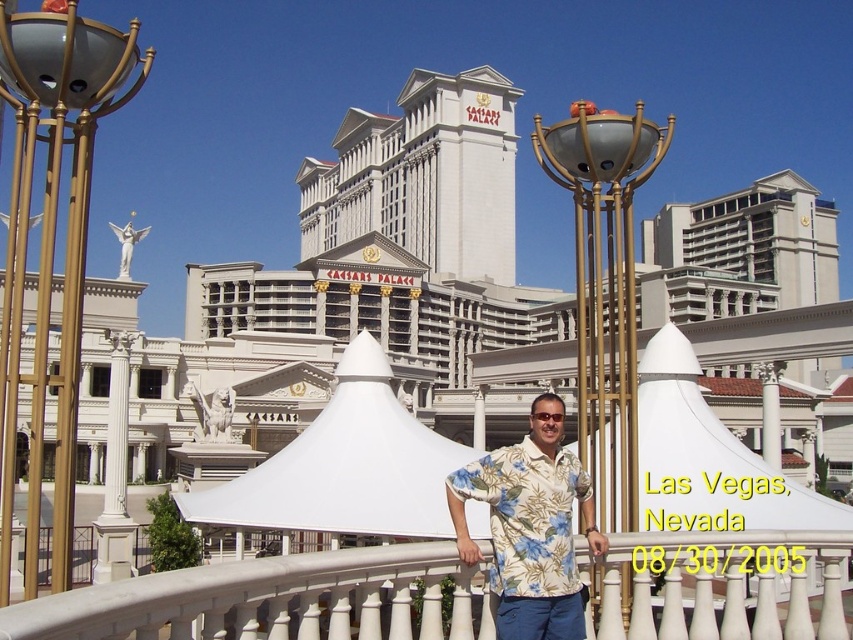
Does white glossy rail at center have a greater width compared to gold metallic lamp post at center?

Incorrect, white glossy rail at center's width does not surpass gold metallic lamp post at center's.

Does white glossy rail at center appear on the left side of gold metallic lamp post at center?

Yes, white glossy rail at center is to the left of gold metallic lamp post at center.

This screenshot has height=640, width=853. What are the coordinates of `white glossy rail at center` in the screenshot? It's located at (270, 600).

Identify the location of white glossy rail at center. (270, 600).

Can you confirm if gold metallic lamp post at upper left is wider than gold metallic lamp post at center?

Indeed, gold metallic lamp post at upper left has a greater width compared to gold metallic lamp post at center.

Consider the image. Does gold metallic lamp post at upper left have a lesser width compared to gold metallic lamp post at center?

No.

Which is in front, point (32, 406) or point (646, 129)?

Positioned in front is point (32, 406).

Locate an element on the screen. This screenshot has height=640, width=853. gold metallic lamp post at upper left is located at coordinates (51, 244).

Is point (20, 134) closer to viewer compared to point (419, 515)?

Yes, point (20, 134) is closer to viewer.

Can you confirm if gold metallic lamp post at upper left is wider than white fabric canopy at center?

Correct, the width of gold metallic lamp post at upper left exceeds that of white fabric canopy at center.

Is point (102, 45) closer to camera compared to point (415, 428)?

Yes, it is.

Find the location of `gold metallic lamp post at upper left`. gold metallic lamp post at upper left is located at coordinates (51, 244).